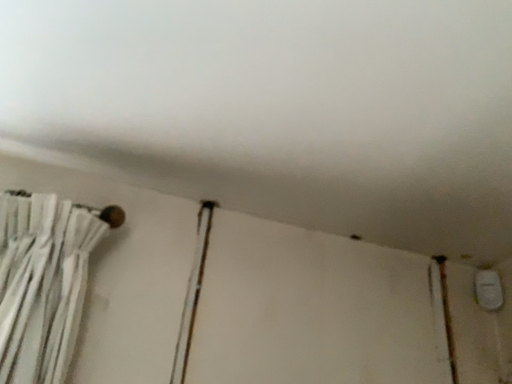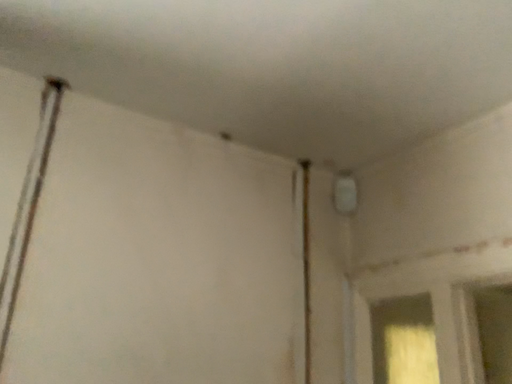
Question: Which way did the camera rotate in the video?

Choices:
 (A) rotated downward
 (B) rotated upward

Answer: (A)